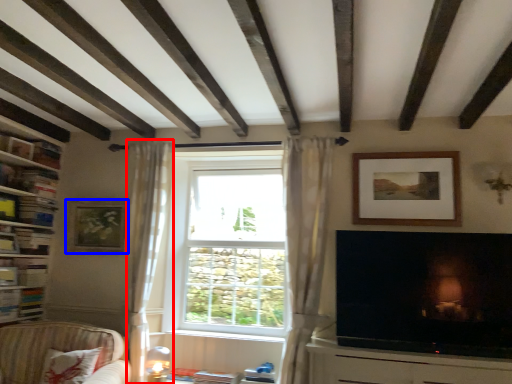
Question: Among these objects, which one is nearest to the camera, curtain (highlighted by a red box) or picture frame (highlighted by a blue box)?

Choices:
 (A) curtain
 (B) picture frame

Answer: (A)